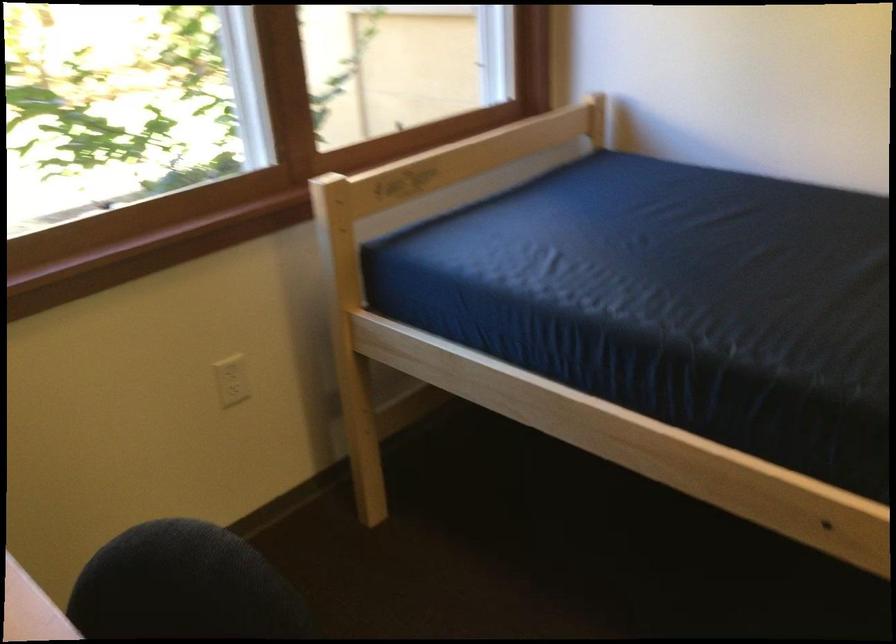
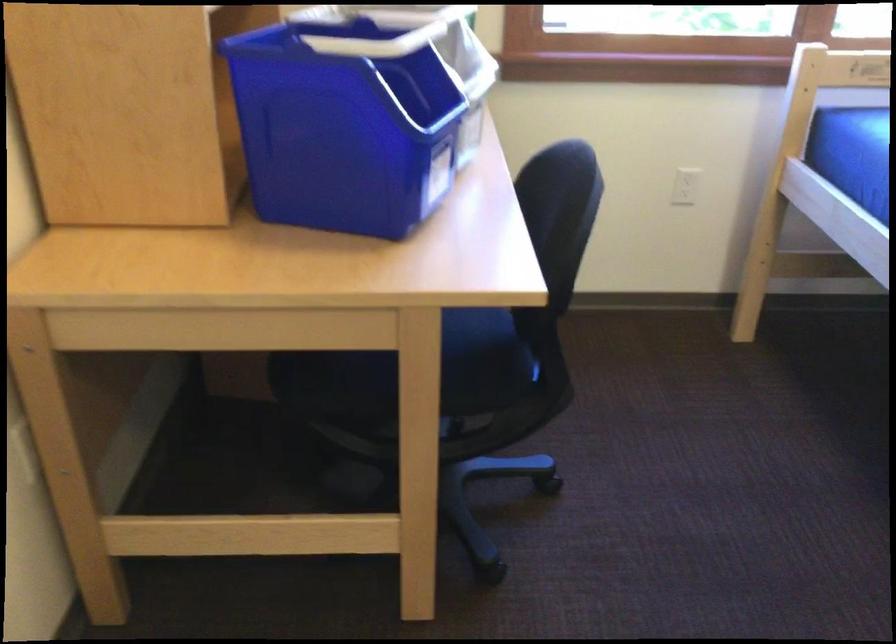
In the second image, find the point that corresponds to the point at 238,388 in the first image.

(683, 187)